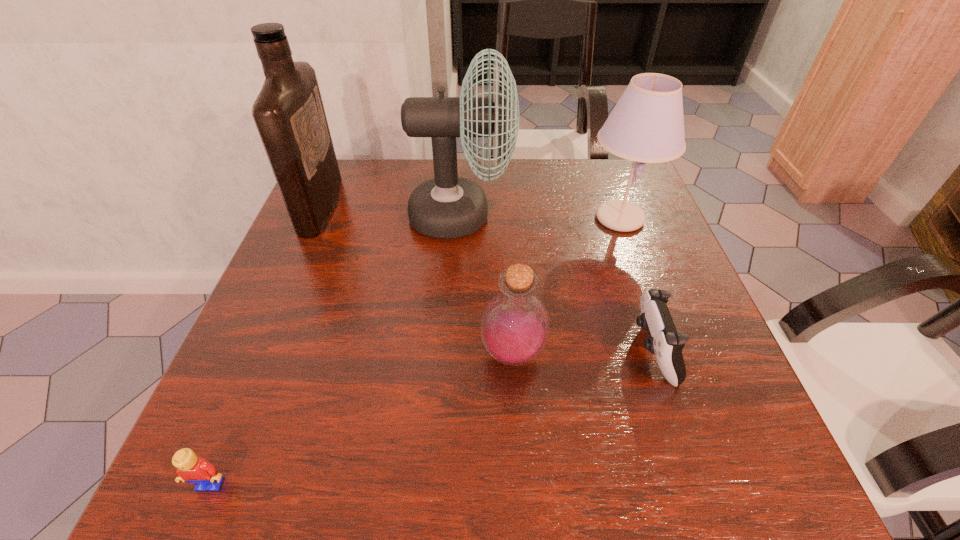
Where is `unoccupied position between the nearest object and the fourth shortest object`? Image resolution: width=960 pixels, height=540 pixels. unoccupied position between the nearest object and the fourth shortest object is located at coordinates (416, 351).

Identify the location of object that is the closest to the fan. (647, 124).

Point out which object is positioned as the fifth nearest to the control. Please provide its 2D coordinates. Your answer should be formatted as a tuple, i.e. [(x, y)], where the tuple contains the x and y coordinates of a point satisfying the conditions above.

[(289, 114)]

You are a GUI agent. You are given a task and a screenshot of the screen. Output one action in this format:
    pyautogui.click(x=<x>, y=<y>)
    Task: Click on the free space that satisfies the following two spatial constraints: 1. on the back side of the fourth tallest object; 2. on the label side of the liquor
    
    Given the screenshot: What is the action you would take?
    pyautogui.click(x=503, y=206)

The height and width of the screenshot is (540, 960). In order to click on blank space that satisfies the following two spatial constraints: 1. on the label side of the liquor; 2. on the right side of the bottle in this screenshot , I will do `click(257, 354)`.

Locate an element on the screen. vacant area in the image that satisfies the following two spatial constraints: 1. on the front side of the third tallest object; 2. on the front-facing side of the control is located at coordinates (668, 350).

I want to click on free spot that satisfies the following two spatial constraints: 1. on the label side of the liquor; 2. on the left side of the bottle, so click(x=257, y=354).

Locate an element on the screen. The height and width of the screenshot is (540, 960). free region that satisfies the following two spatial constraints: 1. on the label side of the liquor; 2. on the left side of the third shortest object is located at coordinates (257, 354).

Identify the location of vacant area that satisfies the following two spatial constraints: 1. on the label side of the lampshade; 2. on the right side of the liquor. (316, 218).

Locate an element on the screen. blank space that satisfies the following two spatial constraints: 1. in front of the fan where the airflow is directed; 2. on the front-facing side of the Lego is located at coordinates (447, 484).